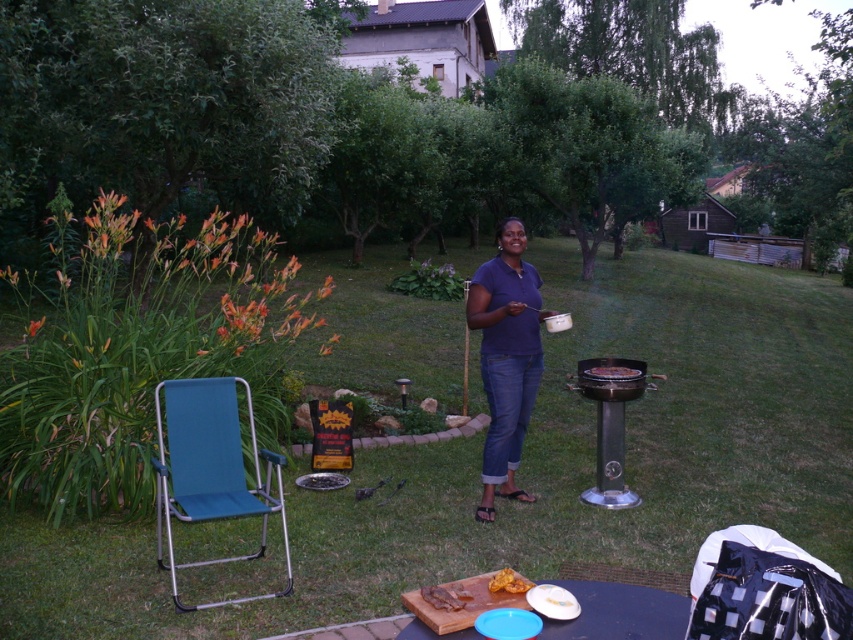
You are planning to make a sandwich using the brown crispy meat at center and the yellow matte bread at center. To assemble the sandwich properly, which item should you place first on the bread?

The brown crispy meat at center should be placed first on the yellow matte bread at center since it is located below the bread in the image.

You are standing at the barbecue grill area in the evening and want to grab a drink from the cooler that is 3 meters away from you. If you walk straight from the stainless steel barbecue grill at center right to the cooler, will you be able to reach the cooler within 2 meters?

The stainless steel barbecue grill at center right and viewer are 5.42 meters apart from each other. Since the cooler is 3 meters away from you, you can reach it within 2 meters by walking straight from the barbecue grill.